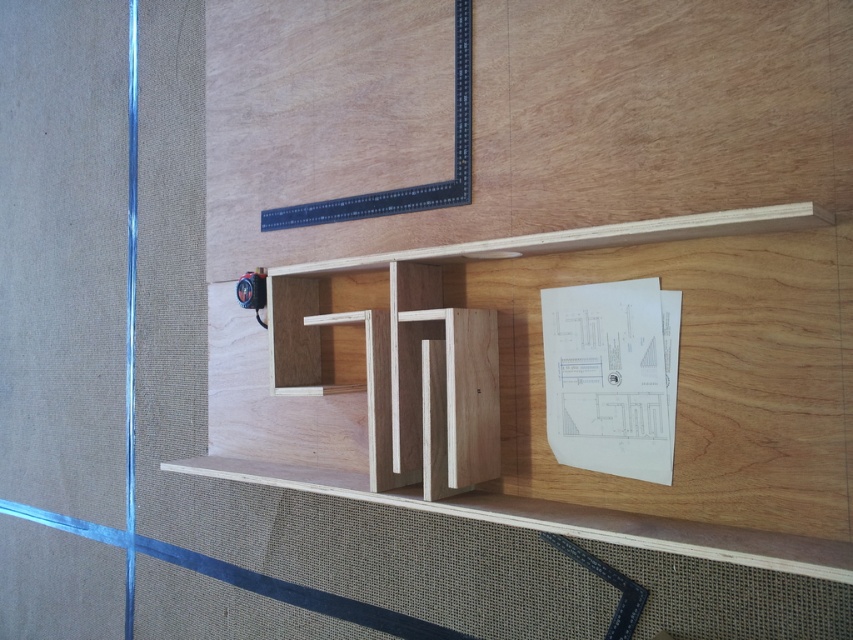
You are organizing a storage area and need to place both the natural wood shelf at center and the transparent glass door at left. Given their sizes, which one requires more space to accommodate?

The transparent glass door at left requires more space because the natural wood shelf at center occupies less space than it.

You are organizing items in a workshop and need to place a new tool box. The natural wood shelf at center and the transparent glass door at left are both options. Based on their heights, which one can you place the tool box on without it exceeding the height limit?

The natural wood shelf at center is shorter than the transparent glass door at left, so placing the tool box on the natural wood shelf at center would ensure it doesn not exceed the height limit.

You are organizing tools in a workshop and need to place a new tool on the natural wood shelf at center. Where exactly should you place it according to the coordinates provided?

The natural wood shelf at center is located at point coordinates [543,369], so place the tool there.